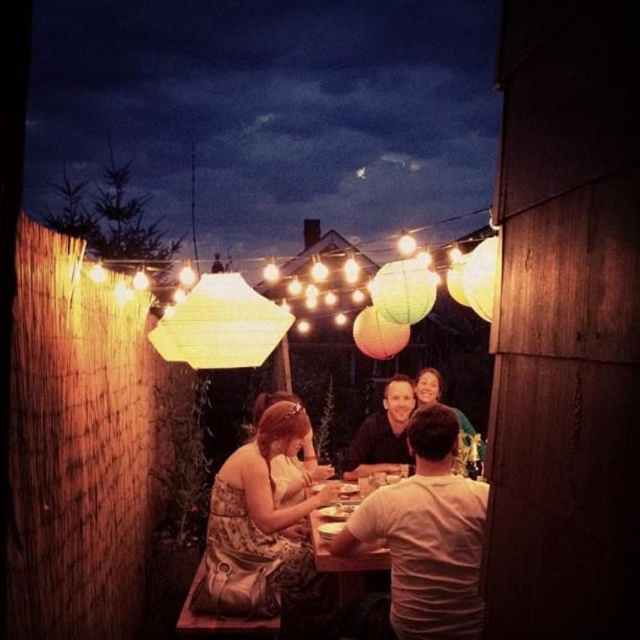
Based on the photo, you are a photographer at the event and want to capture a photo of the matte black shirt at center and the wooden table at center. Which object is positioned higher in the frame?

The matte black shirt at center is located above the wooden table at center, so it is positioned higher in the frame.

You are a photographer at the event and want to capture a photo of both the patterned fabric dress at center and the matte black shirt at center. Which one should you focus on first to ensure they are both in frame?

The patterned fabric dress at center is positioned on the left side of matte black shirt at center, so you should focus on the patterned fabric dress at center first to ensure both are in frame.